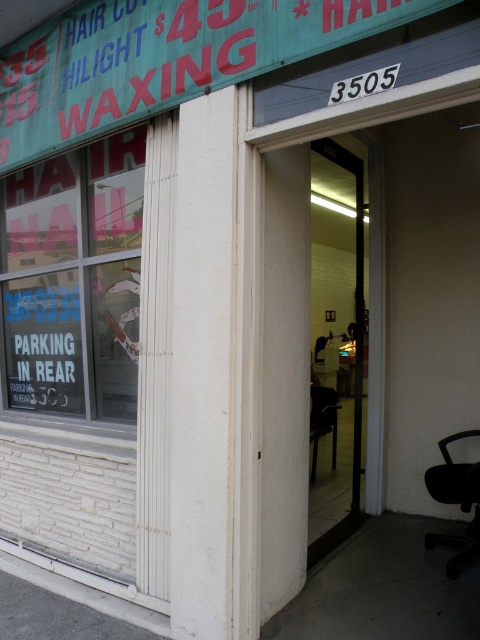
Question: Which point appears closest to the camera in this image?

Choices:
 (A) [476, 468]
 (B) [101, 182]
 (C) [311, 432]

Answer: (A)

Question: Estimate the real-world distances between objects in this image. Which object is closer to the clear glass window at upper left?

Choices:
 (A) black plastic chair at center
 (B) black plastic swivel chair at lower right

Answer: (B)

Question: Can you confirm if black plastic swivel chair at lower right is positioned to the right of black plastic chair at center?

Choices:
 (A) no
 (B) yes

Answer: (B)

Question: Which point is farther from the camera taking this photo?

Choices:
 (A) (61, 321)
 (B) (312, 394)
 (C) (472, 496)

Answer: (B)

Question: Is clear glass window at upper left further to the viewer compared to black plastic swivel chair at lower right?

Choices:
 (A) yes
 (B) no

Answer: (B)

Question: From the image, what is the correct spatial relationship of black plastic swivel chair at lower right in relation to black plastic chair at center?

Choices:
 (A) above
 (B) below

Answer: (B)